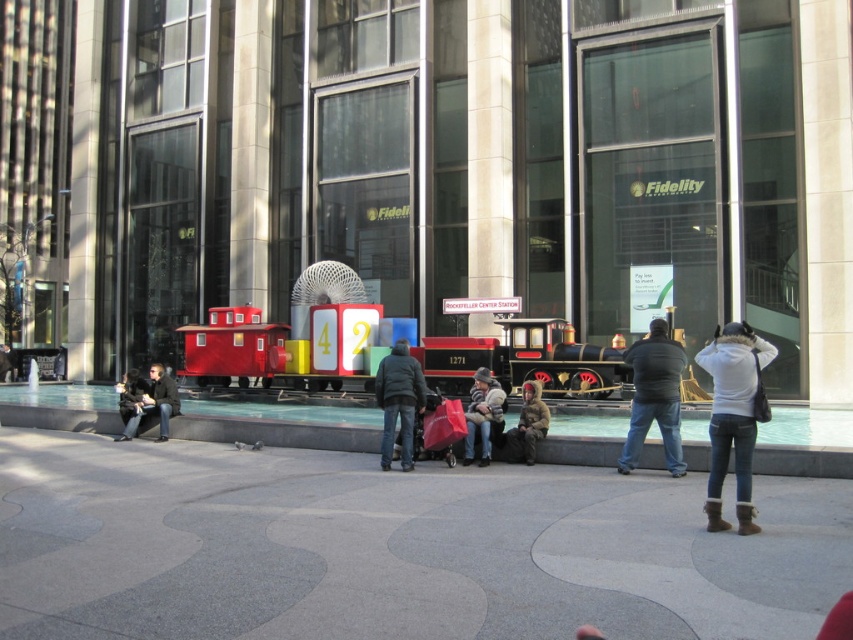
Question: Is gray woolen sweater at center smaller than dark gray jacket at left?

Choices:
 (A) yes
 (B) no

Answer: (B)

Question: In this image, where is dark gray jacket at center located relative to dark gray jacket at lower left?

Choices:
 (A) below
 (B) above

Answer: (B)

Question: Considering the real-world distances, which object is closest to the dark gray jacket at lower left?

Choices:
 (A) dark gray jacket at left
 (B) white fleece jacket at center
 (C) black matte jacket at center

Answer: (A)

Question: Which point appears closest to the camera in this image?

Choices:
 (A) (740, 524)
 (B) (399, 412)

Answer: (A)

Question: Can you confirm if matte red train at center is smaller than camouflage jacket at center?

Choices:
 (A) no
 (B) yes

Answer: (A)

Question: Among these points, which one is farthest from the camera?

Choices:
 (A) pyautogui.click(x=537, y=387)
 (B) pyautogui.click(x=639, y=356)
 (C) pyautogui.click(x=149, y=406)
 (D) pyautogui.click(x=503, y=356)

Answer: (D)